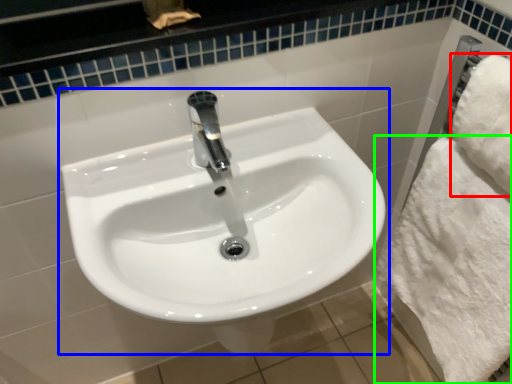
Question: Considering the real-world distances, which object is farthest from bath towel (highlighted by a red box)? sink (highlighted by a blue box) or bath towel (highlighted by a green box)?

Choices:
 (A) sink
 (B) bath towel

Answer: (A)